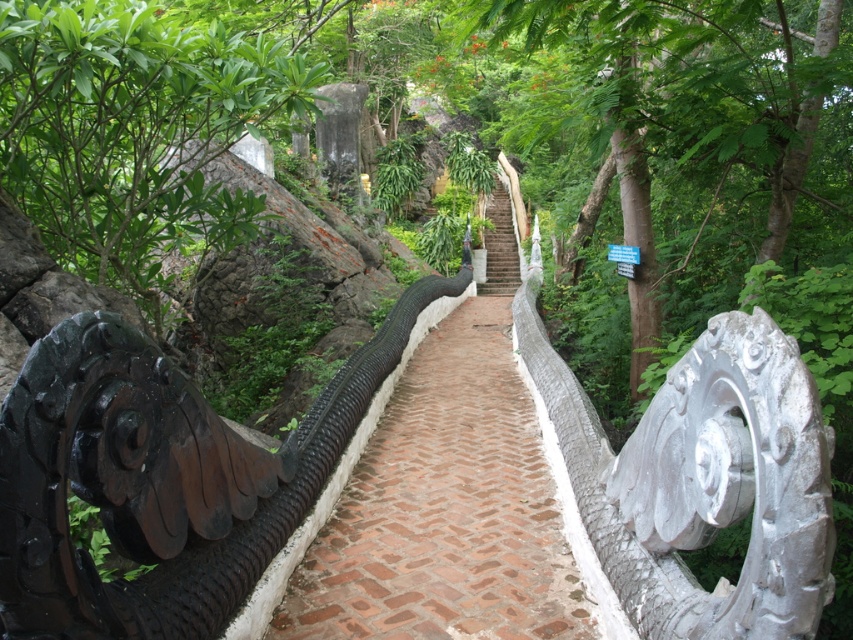
You are standing on the pathway and want to take a photo of both the green leafy tree at left and the white stone stairs at center. Which object should you focus on first to ensure both are in frame?

You should focus on the green leafy tree at left first since it is closer to the viewer than the white stone stairs at center, ensuring both are in frame by adjusting the camera angle accordingly.

Based on the photo, you are a gardener wanting to plant a new tree between the green leafy tree at center and the white stone stairs at center. Which side should you choose to ensure the new tree has enough space to grow without overcrowding?

The green leafy tree at center might be wider than the white stone stairs at center, so planting the new tree on the side of the white stone stairs at center would provide more space for growth.